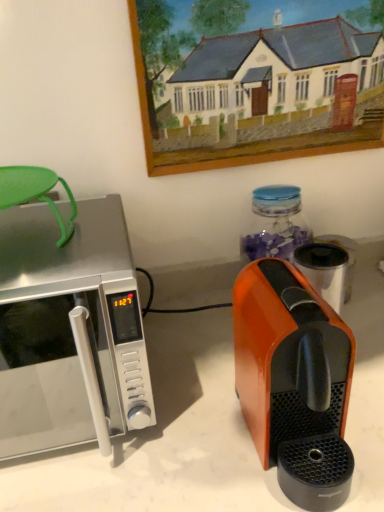
The height and width of the screenshot is (512, 384). In order to click on free point above orange glossy coffee maker at right (from a real-world perspective) in this screenshot , I will do `click(284, 288)`.